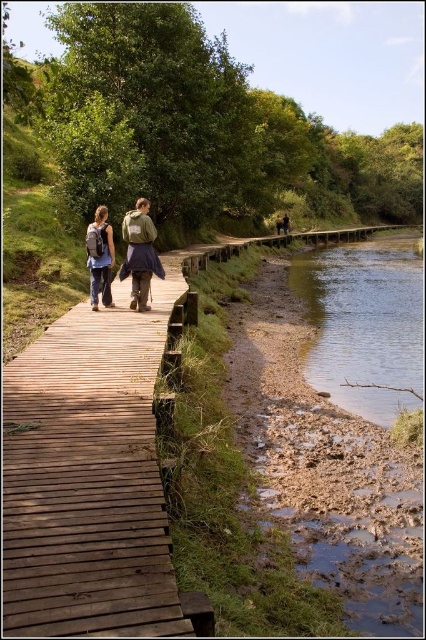
Is brown wooden boardwalk at center to the left of matte brown backpack at center from the viewer's perspective?

Incorrect, brown wooden boardwalk at center is not on the left side of matte brown backpack at center.

Is brown wooden boardwalk at center bigger than matte brown backpack at center?

Yes, brown wooden boardwalk at center is bigger than matte brown backpack at center.

Describe the element at coordinates (89, 476) in the screenshot. This screenshot has height=640, width=426. I see `brown wooden boardwalk at center` at that location.

Identify the location of brown wooden boardwalk at center. (89, 476).

Consider the image. Who is positioned more to the left, brown wooden boardwalk at center or matte black backpack at left?

matte black backpack at left

How much distance is there between brown wooden boardwalk at center and matte black backpack at left?

A distance of 8.14 feet exists between brown wooden boardwalk at center and matte black backpack at left.

Which is in front, point (155, 310) or point (88, 250)?

Point (155, 310) is more forward.

This screenshot has height=640, width=426. Find the location of `brown wooden boardwalk at center`. brown wooden boardwalk at center is located at coordinates (89, 476).

Does brown wooden boardwalk at center have a greater height compared to brown leather backpack at center?

Yes.

Is brown wooden boardwalk at center wider than brown leather backpack at center?

Yes.

What do you see at coordinates (89, 476) in the screenshot?
I see `brown wooden boardwalk at center` at bounding box center [89, 476].

Locate an element on the screen. Image resolution: width=426 pixels, height=640 pixels. brown wooden boardwalk at center is located at coordinates pyautogui.click(x=89, y=476).